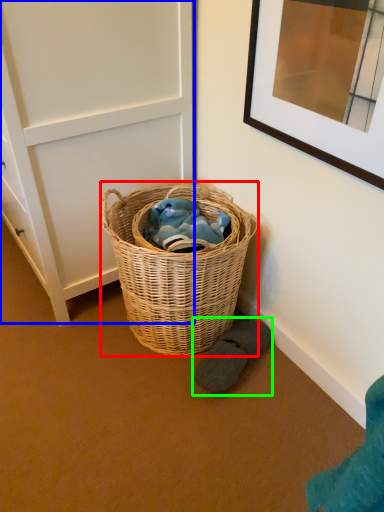
Question: Which object is the closest to the picnic basket (highlighted by a red box)? Choose among these: door (highlighted by a blue box) or footwear (highlighted by a green box).

Choices:
 (A) door
 (B) footwear

Answer: (B)